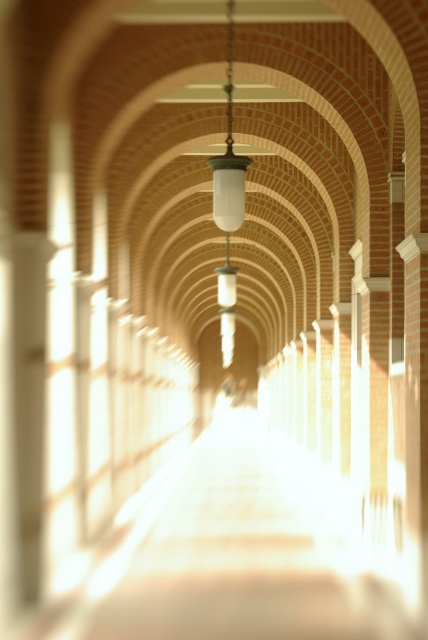
Question: Is white glossy path at center to the right of matte glass lamp at center from the viewer's perspective?

Choices:
 (A) no
 (B) yes

Answer: (A)

Question: Is white glossy path at center smaller than matte glass lamp at center?

Choices:
 (A) yes
 (B) no

Answer: (B)

Question: Is white glossy path at center to the left of matte glass lamp at center from the viewer's perspective?

Choices:
 (A) no
 (B) yes

Answer: (B)

Question: Which point is closer to the camera taking this photo?

Choices:
 (A) (291, 497)
 (B) (240, 161)

Answer: (B)

Question: Which object appears closest to the camera in this image?

Choices:
 (A) matte glass lamp at center
 (B) white glossy path at center

Answer: (B)